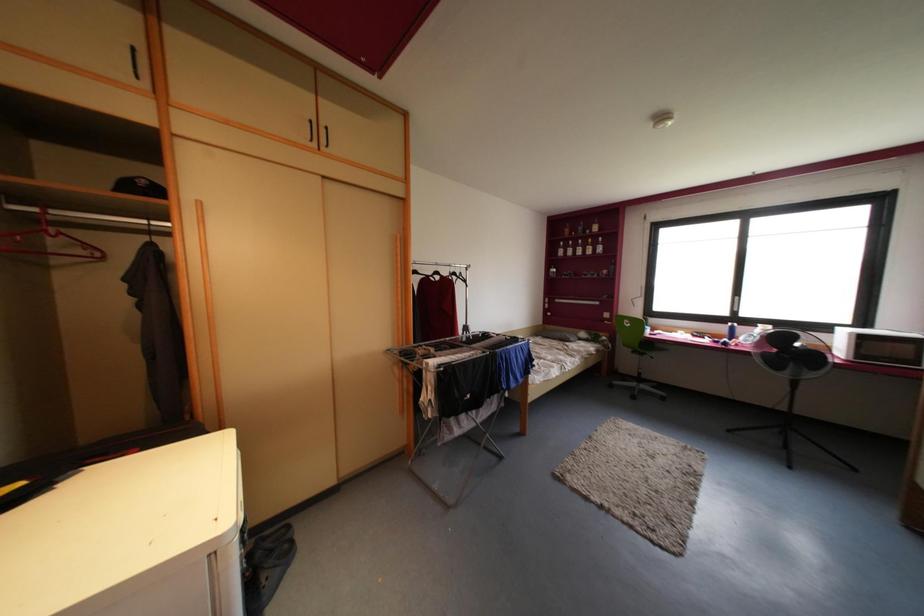
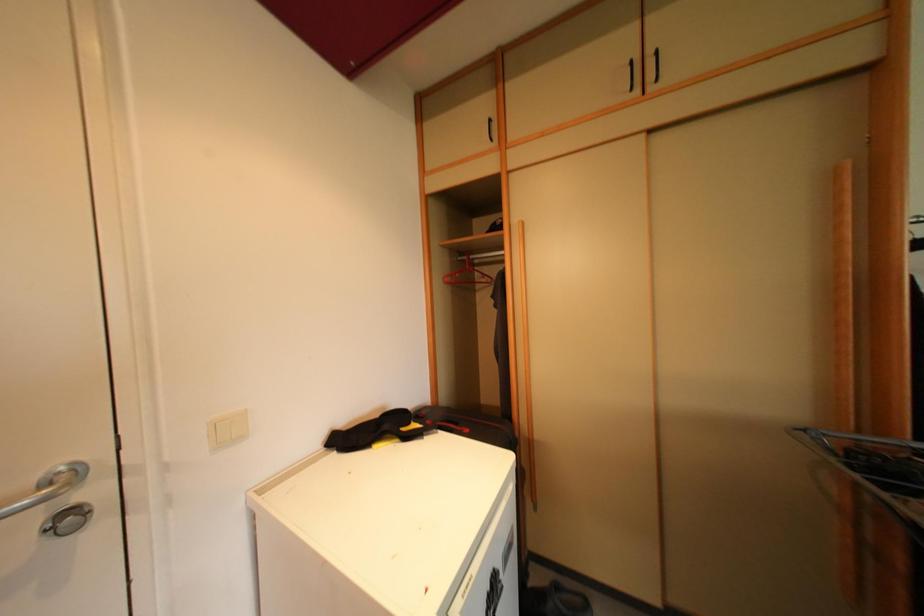
Question: The first image is from the beginning of the video and the second image is from the end. How did the camera likely rotate when shooting the video?

Choices:
 (A) Left
 (B) Right
 (C) Up
 (D) Down

Answer: (A)